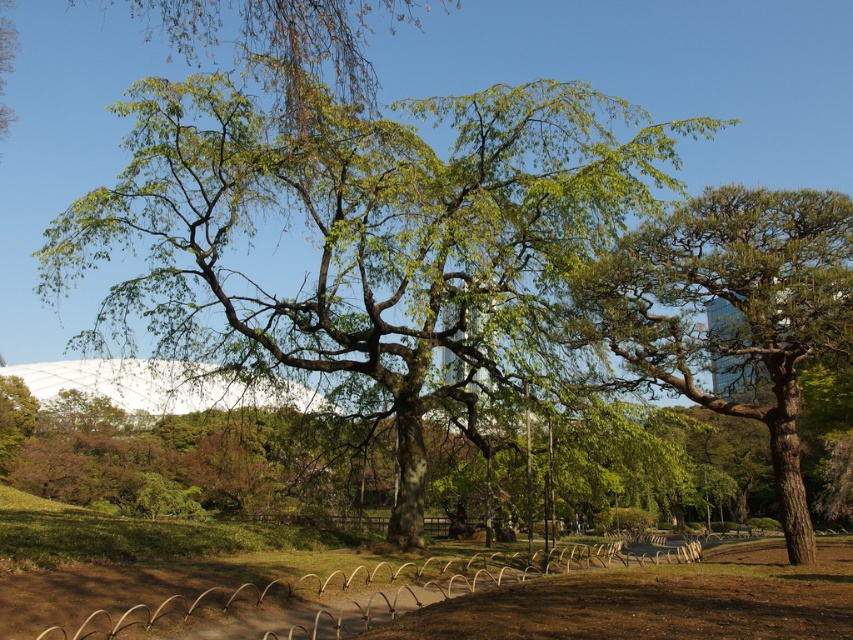
Question: Is green leafy oak tree at center to the left of green textured tree at right from the viewer's perspective?

Choices:
 (A) yes
 (B) no

Answer: (A)

Question: Does green leafy oak tree at center have a greater width compared to green textured tree at right?

Choices:
 (A) yes
 (B) no

Answer: (A)

Question: Observing the image, what is the correct spatial positioning of green leafy oak tree at center in reference to green textured tree at right?

Choices:
 (A) right
 (B) left

Answer: (B)

Question: Which object appears farthest from the camera in this image?

Choices:
 (A) green leafy oak tree at center
 (B) green textured tree at right

Answer: (A)